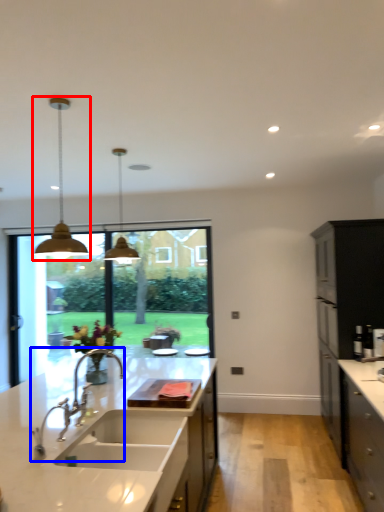
Question: Which of the following is the farthest to the observer, lamp (highlighted by a red box) or tap (highlighted by a blue box)?

Choices:
 (A) lamp
 (B) tap

Answer: (A)